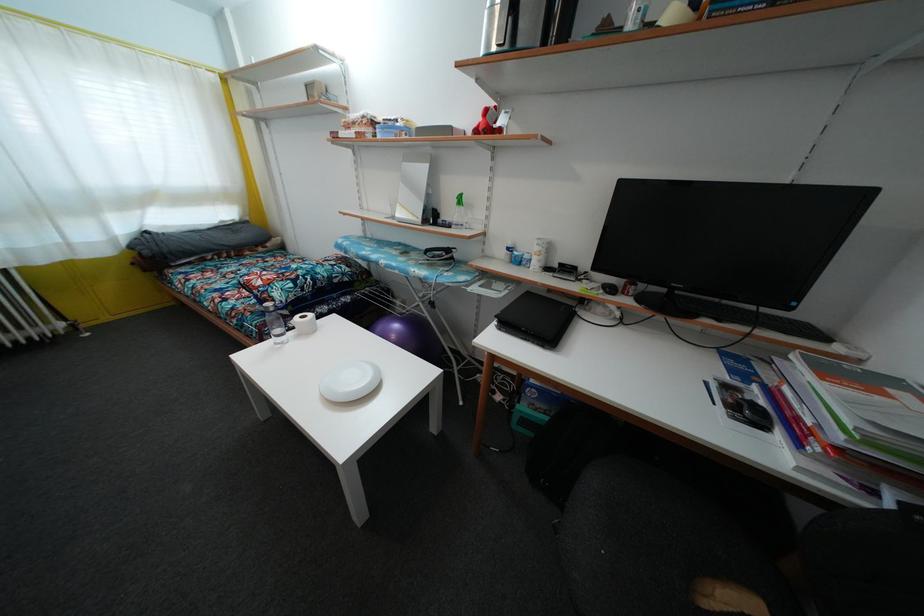
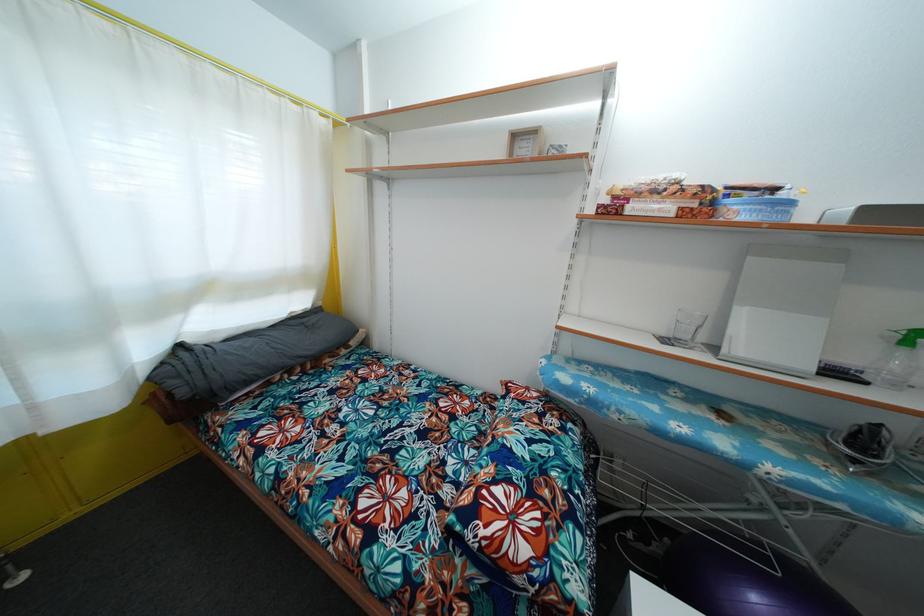
Find the pixel in the second image that matches (150,259) in the first image.

(187, 399)